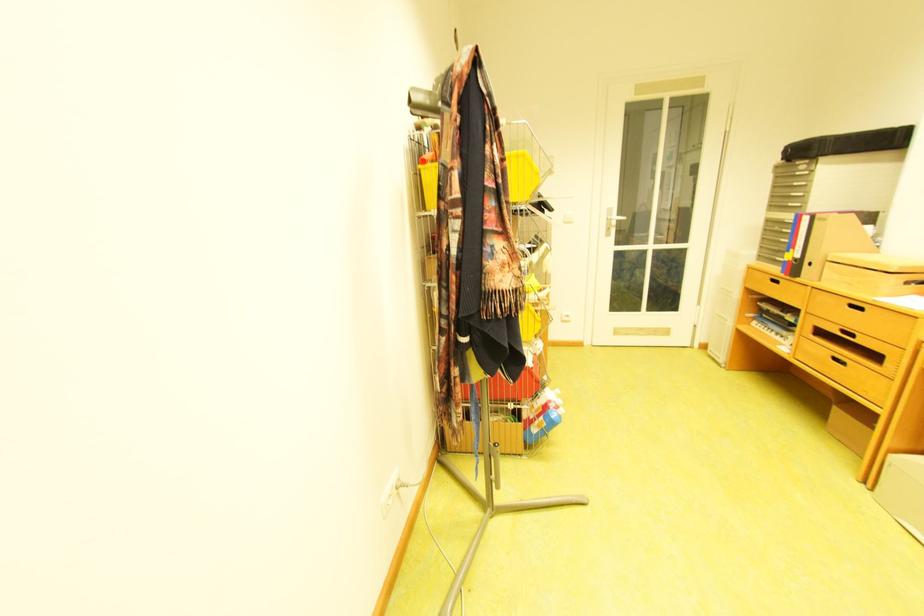
Find where to turn the white door handle. Please return your answer as a coordinate pair (x, y).

(616, 217)